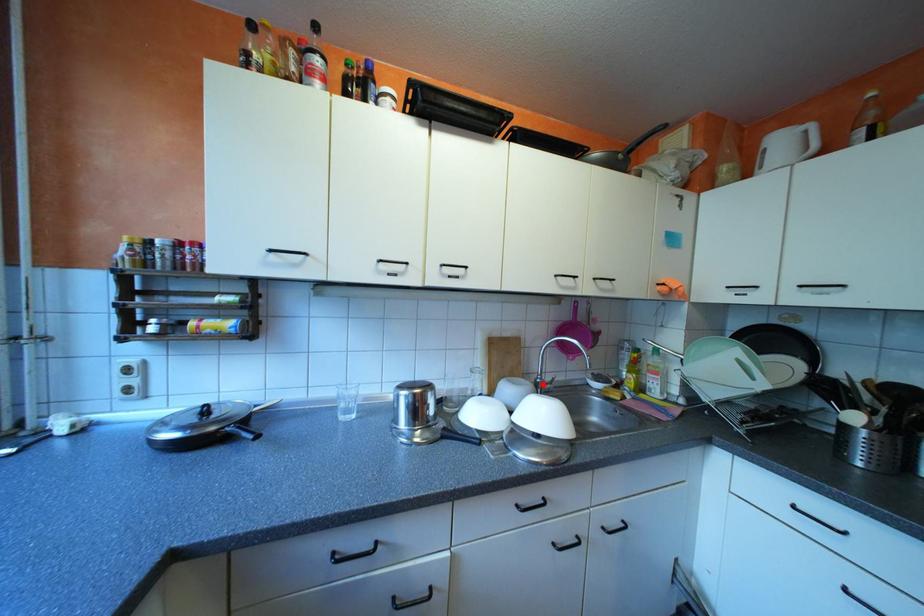
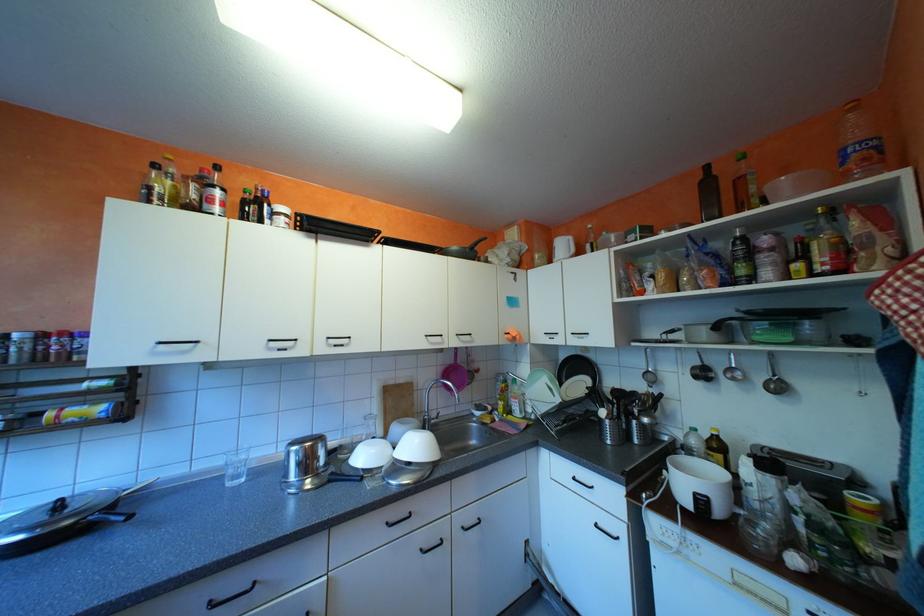
Question: I am providing you with two images of the same scene from different viewpoints. A red point is marked on the first image. At the location where the point appears in image 1, is it still visible in image 2?

Choices:
 (A) Yes
 (B) No

Answer: (A)